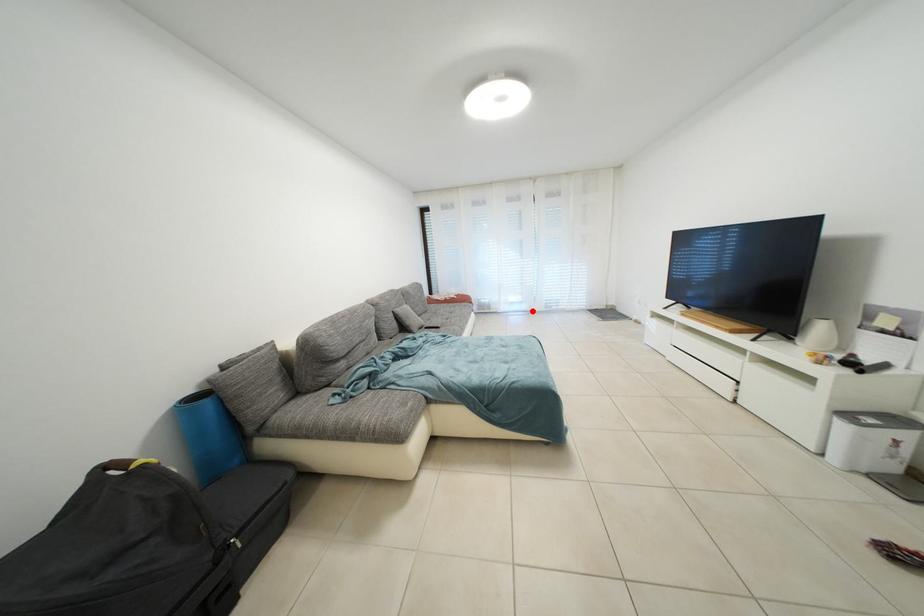
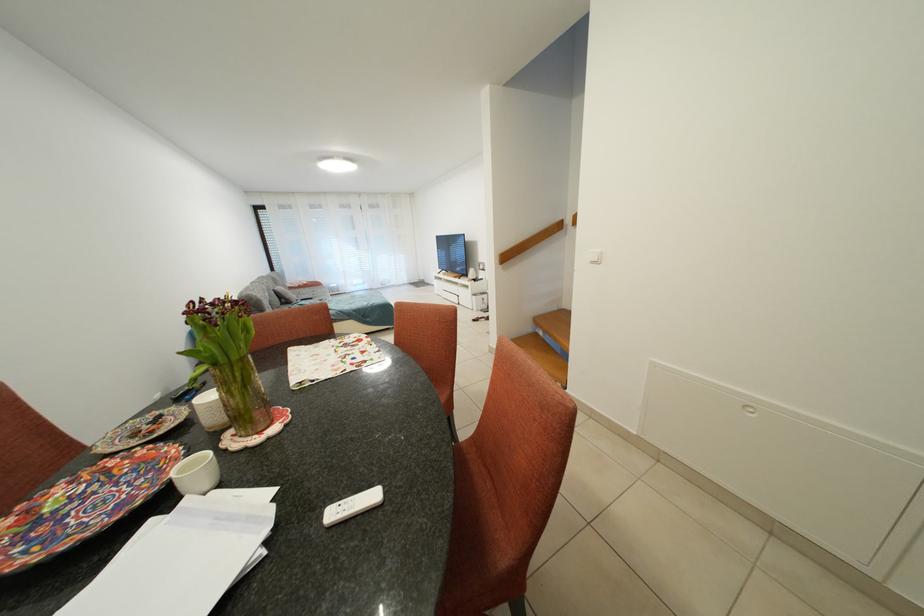
Where in the second image is the point corresponding to the highlighted location from the first image?

(373, 291)